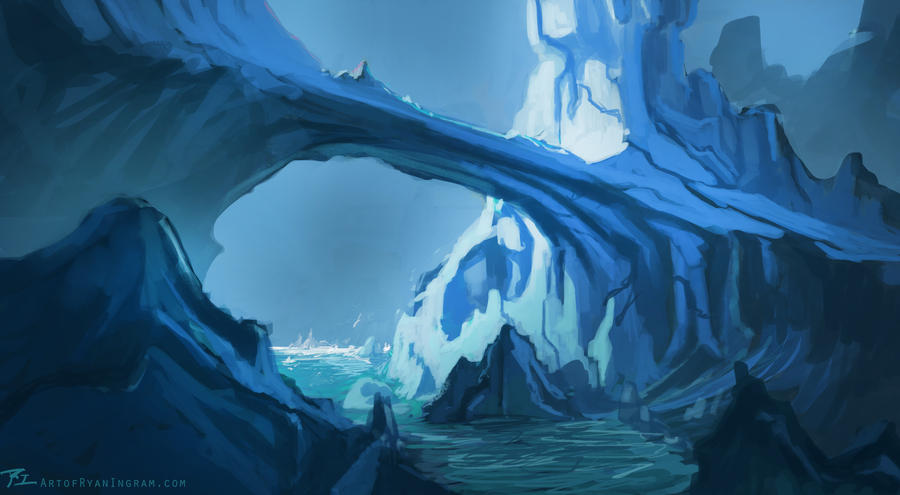
Locate an element on the screen. This screenshot has height=495, width=900. painting is located at coordinates (730, 249).